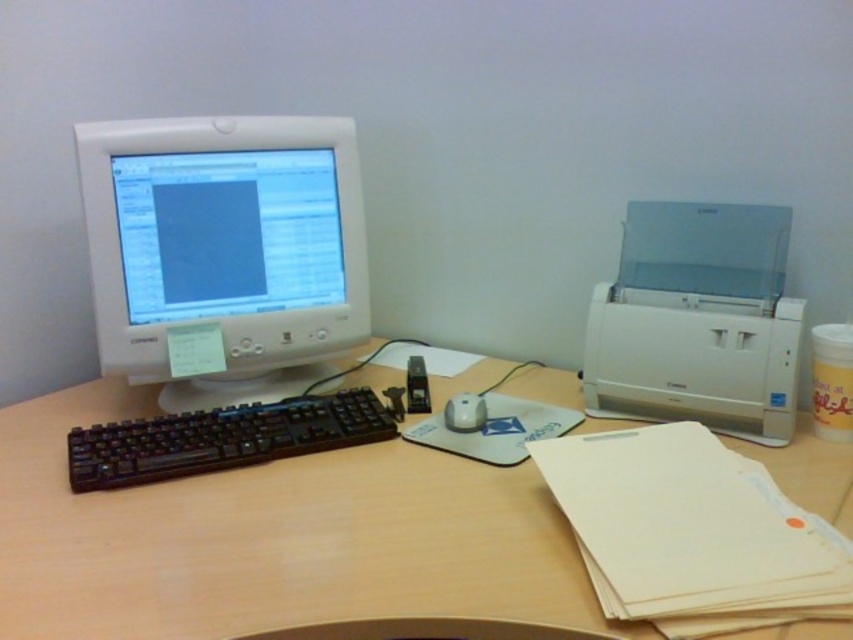
Does black plastic keyboard at left have a greater height compared to white glossy mouse at center?

Correct, black plastic keyboard at left is much taller as white glossy mouse at center.

Who is lower down, black plastic keyboard at left or white glossy mouse at center?

Positioned lower is black plastic keyboard at left.

Identify the location of black plastic keyboard at left. (223, 438).

Where is `black plastic keyboard at left`? black plastic keyboard at left is located at coordinates (223, 438).

Describe the element at coordinates (271, 538) in the screenshot. I see `wooden at center` at that location.

In order to click on wooden at center in this screenshot , I will do `click(271, 538)`.

The height and width of the screenshot is (640, 853). In order to click on wooden at center in this screenshot , I will do `click(271, 538)`.

How far apart are wooden at center and white glossy monitor at upper left?

wooden at center is 13.96 inches from white glossy monitor at upper left.

Which is below, wooden at center or white glossy monitor at upper left?

wooden at center is below.

Find the location of a particular element. The image size is (853, 640). wooden at center is located at coordinates (271, 538).